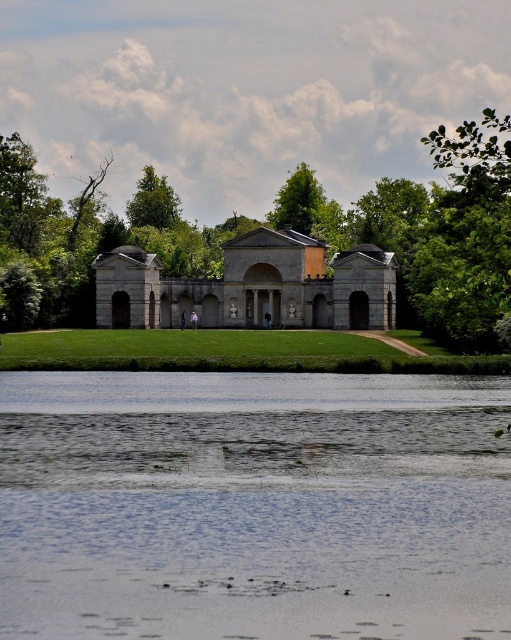
Question: Is clear water at lower center positioned in front of green leafy tree at upper right?

Choices:
 (A) no
 (B) yes

Answer: (B)

Question: Is clear water at lower center in front of green leafy tree at center?

Choices:
 (A) no
 (B) yes

Answer: (B)

Question: Based on their relative distances, which object is nearer to the light gray stone palace at center?

Choices:
 (A) green leafy tree at upper right
 (B) green leafy tree at center
 (C) clear water at lower center

Answer: (B)

Question: Estimate the real-world distances between objects in this image. Which object is farther from the light gray stone palace at center?

Choices:
 (A) green leafy tree at center
 (B) clear water at lower center
 (C) green leafy tree at upper right

Answer: (B)

Question: Which is nearer to the green leafy tree at center?

Choices:
 (A) light gray stone palace at center
 (B) green leafy tree at upper right
 (C) green leafy tree at upper center
 (D) clear water at lower center

Answer: (A)

Question: In this image, where is clear water at lower center located relative to green leafy tree at upper right?

Choices:
 (A) below
 (B) above

Answer: (A)